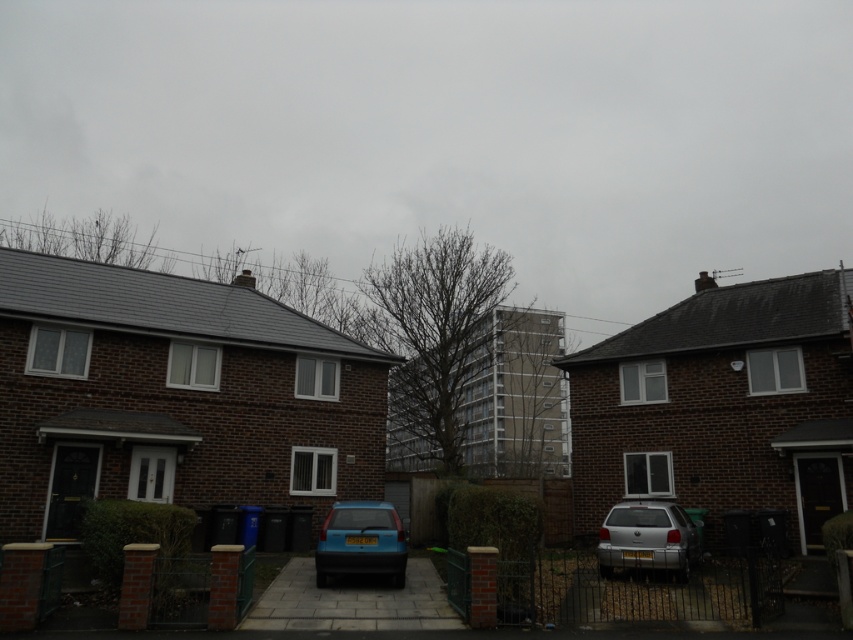
Question: Does silver metallic suv at lower right have a greater width compared to matte blue hatchback at center?

Choices:
 (A) no
 (B) yes

Answer: (B)

Question: Which point appears closest to the camera in this image?

Choices:
 (A) (317, 582)
 (B) (676, 545)

Answer: (A)

Question: Does silver metallic suv at lower right appear over matte blue hatchback at center?

Choices:
 (A) no
 (B) yes

Answer: (A)

Question: Among these objects, which one is farthest from the camera?

Choices:
 (A) matte blue hatchback at center
 (B) silver metallic suv at lower right

Answer: (B)

Question: Is the position of silver metallic suv at lower right less distant than that of matte blue hatchback at center?

Choices:
 (A) yes
 (B) no

Answer: (B)